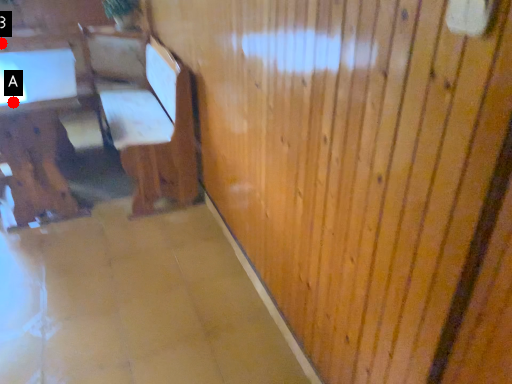
Question: Two points are circled on the image, labeled by A and B beside each circle. Which point is farther from the camera taking this photo?

Choices:
 (A) A is further
 (B) B is further

Answer: (B)